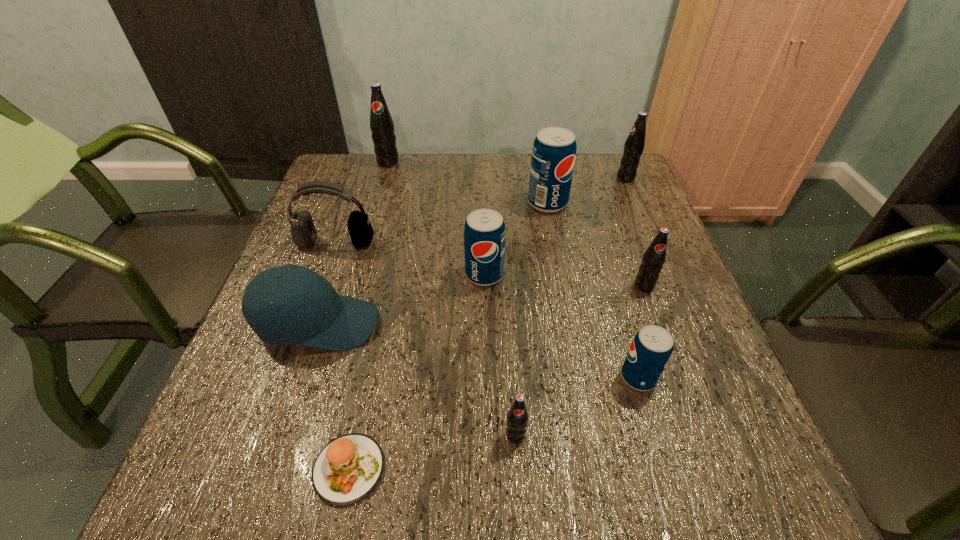
This screenshot has height=540, width=960. Identify the location of object located at the near edge. (347, 469).

Find the location of a particular element. The image size is (960, 540). pop situated at the left edge is located at coordinates (381, 123).

This screenshot has width=960, height=540. What are the coordinates of `headset that is positioned at the left edge` in the screenshot? It's located at (303, 231).

This screenshot has height=540, width=960. I want to click on baseball cap that is positioned at the left edge, so click(x=320, y=318).

Identify the location of object situated at the far left corner. The image size is (960, 540). (381, 123).

Where is `object at the far right corner`? The image size is (960, 540). object at the far right corner is located at coordinates (634, 145).

In the image, there is a desktop. At what (x,y) coordinates should I click in order to perform the action: click on blank space at the far edge. Please return your answer as a coordinate pair (x, y). Image resolution: width=960 pixels, height=540 pixels. Looking at the image, I should click on (408, 156).

The image size is (960, 540). In order to click on free region at the near edge of the desktop in this screenshot , I will do `click(461, 508)`.

In the image, there is a desktop. Where is `vacant space at the left edge`? vacant space at the left edge is located at coordinates (357, 258).

Locate an element on the screen. The height and width of the screenshot is (540, 960). blank area at the right edge is located at coordinates (677, 345).